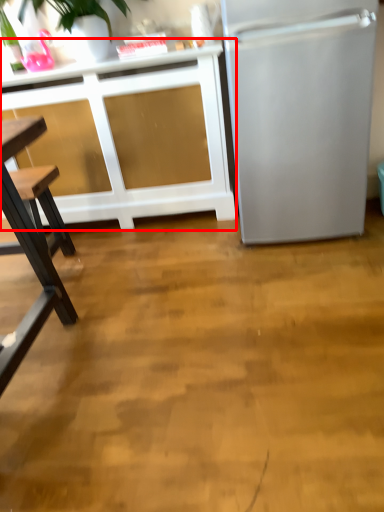
Question: Observing the image, what is the correct spatial positioning of cabinetry (annotated by the red box) in reference to refrigerator?

Choices:
 (A) left
 (B) right

Answer: (A)